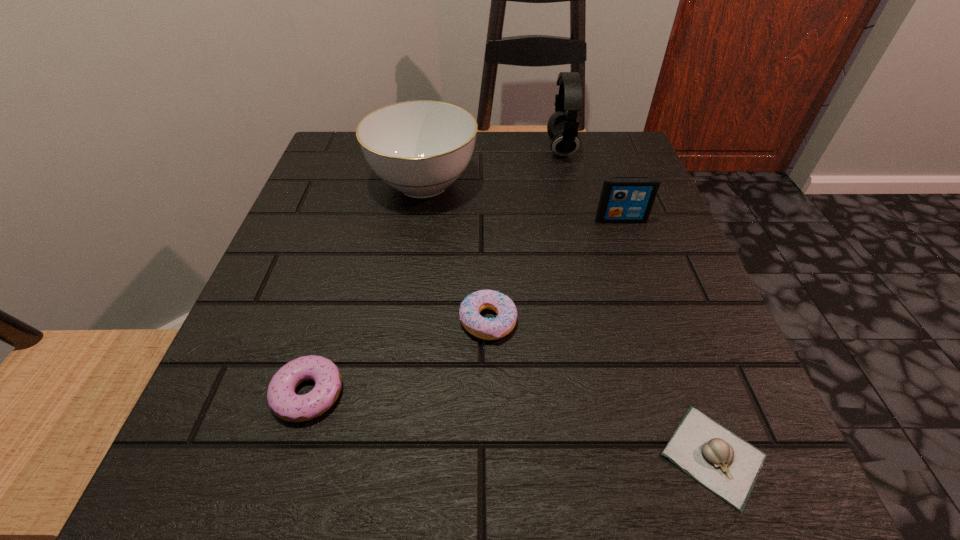
I want to click on the tallest object, so click(562, 127).

Find the location of a particular element. the second tallest object is located at coordinates (420, 148).

The width and height of the screenshot is (960, 540). I want to click on iPod, so click(x=623, y=199).

This screenshot has height=540, width=960. In order to click on the right doughnut in this screenshot , I will do `click(487, 329)`.

Find the location of a particular element. The height and width of the screenshot is (540, 960). the fourth tallest object is located at coordinates (487, 329).

You are a GUI agent. You are given a task and a screenshot of the screen. Output one action in this format:
    pyautogui.click(x=<x>, y=<y>)
    Task: Click on the shorter doughnut
    This screenshot has height=540, width=960.
    Given the screenshot: What is the action you would take?
    pyautogui.click(x=283, y=401)

Identify the location of the left doughnut. The width and height of the screenshot is (960, 540). (283, 401).

You are a GUI agent. You are given a task and a screenshot of the screen. Output one action in this format:
    pyautogui.click(x=<x>, y=<y>)
    Task: Click on the garlic
    
    Given the screenshot: What is the action you would take?
    pyautogui.click(x=726, y=464)

Find the location of a particular element. Image resolution: width=960 pixels, height=540 pixels. vacant space situated on the ear cups of the earphone is located at coordinates point(404,148).

Where is `free space located 0.070m on the ear cups of the earphone`? This screenshot has height=540, width=960. free space located 0.070m on the ear cups of the earphone is located at coordinates (516, 148).